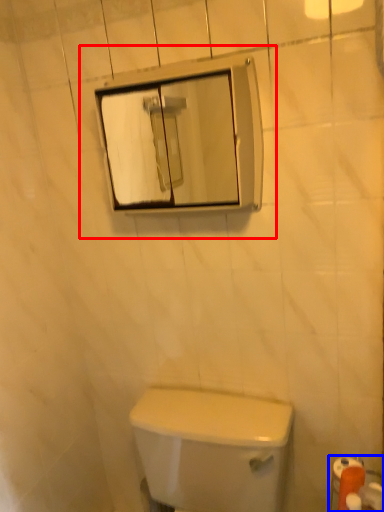
Question: Among these objects, which one is farthest to the camera, view mirror (highlighted by a red box) or toilet paper (highlighted by a blue box)?

Choices:
 (A) view mirror
 (B) toilet paper

Answer: (B)